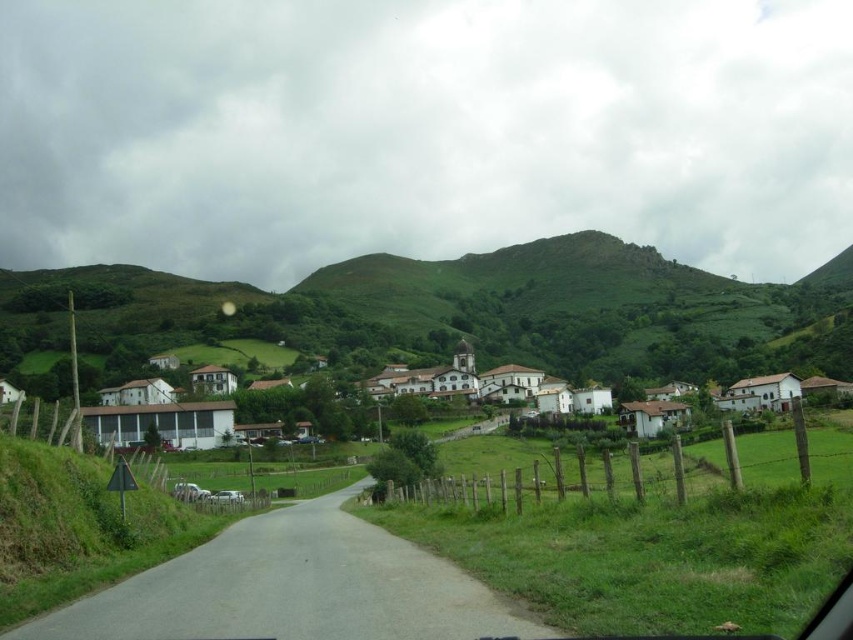
Question: Is green grassy hill at center smaller than white matte houses at center?

Choices:
 (A) yes
 (B) no

Answer: (B)

Question: Is green grassy hill at center to the left of white matte houses at center from the viewer's perspective?

Choices:
 (A) yes
 (B) no

Answer: (B)

Question: Which point is closer to the camera?

Choices:
 (A) (318, 432)
 (B) (550, 369)

Answer: (A)

Question: Does green grassy hill at center appear on the left side of white matte houses at center?

Choices:
 (A) yes
 (B) no

Answer: (B)

Question: Which of the following is the closest to the observer?

Choices:
 (A) (468, 387)
 (B) (497, 285)

Answer: (A)